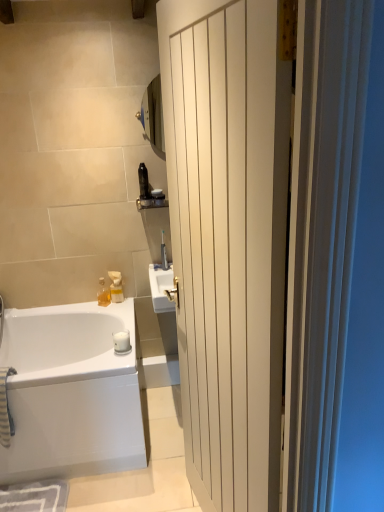
This screenshot has width=384, height=512. I want to click on free space in front of translucent glass bottle at lower left, positioned as the fourth toiletry in top-to-bottom order, so click(109, 309).